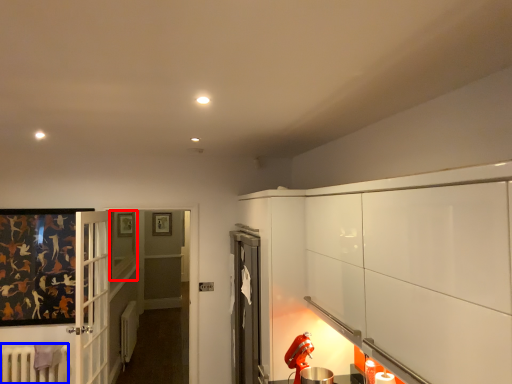
Question: Among these objects, which one is nearest to the camera, window (highlighted by a red box) or radiator (highlighted by a blue box)?

Choices:
 (A) window
 (B) radiator

Answer: (B)